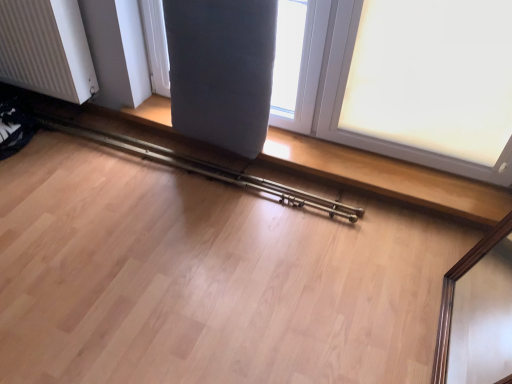
Question: From the image's perspective, would you say metallic brass rail at lower center is shown under matte gray cushion at upper center, which is the 1th window from left to right?

Choices:
 (A) no
 (B) yes

Answer: (B)

Question: Is metallic brass rail at lower center surrounding matte gray cushion at upper center, which is the 1th window from left to right?

Choices:
 (A) no
 (B) yes

Answer: (A)

Question: Considering the relative positions of metallic brass rail at lower center and matte gray cushion at upper center, which is the 1th window from left to right, in the image provided, is metallic brass rail at lower center to the right of matte gray cushion at upper center, which is the 1th window from left to right, from the viewer's perspective?

Choices:
 (A) yes
 (B) no

Answer: (B)

Question: From a real-world perspective, is metallic brass rail at lower center beneath matte gray cushion at upper center, which is the 1th window from left to right?

Choices:
 (A) no
 (B) yes

Answer: (B)

Question: Can you confirm if metallic brass rail at lower center is bigger than matte gray cushion at upper center, which is the 1th window from left to right?

Choices:
 (A) yes
 (B) no

Answer: (B)

Question: Would you say matte gray cushion at upper center, which is the 1th window from left to right, is to the left or to the right of white ribbed radiator at left in the picture?

Choices:
 (A) left
 (B) right

Answer: (B)

Question: Which is correct: matte gray cushion at upper center, the second window positioned from the right, is inside white ribbed radiator at left, or outside of it?

Choices:
 (A) inside
 (B) outside

Answer: (B)

Question: Looking at their shapes, would you say matte gray cushion at upper center, the second window positioned from the right, is wider or thinner than white ribbed radiator at left?

Choices:
 (A) wide
 (B) thin

Answer: (A)

Question: In terms of height, does matte gray cushion at upper center, the second window positioned from the right, look taller or shorter compared to white ribbed radiator at left?

Choices:
 (A) tall
 (B) short

Answer: (A)

Question: Considering their positions, is white frosted glass at upper right, positioned as the 2th window in left-to-right order, located in front of or behind metallic brass rail at lower center?

Choices:
 (A) behind
 (B) front

Answer: (B)

Question: Which is correct: white frosted glass at upper right, marked as the 1th window in a right-to-left arrangement, is inside metallic brass rail at lower center, or outside of it?

Choices:
 (A) outside
 (B) inside

Answer: (A)

Question: Is point (440, 155) closer or farther from the camera than point (135, 142)?

Choices:
 (A) closer
 (B) farther

Answer: (A)

Question: In terms of size, does white frosted glass at upper right, marked as the 1th window in a right-to-left arrangement, appear bigger or smaller than metallic brass rail at lower center?

Choices:
 (A) big
 (B) small

Answer: (A)

Question: From a real-world perspective, is white ribbed radiator at left positioned above or below matte gray cushion at upper center, which is the 1th window from left to right?

Choices:
 (A) below
 (B) above

Answer: (A)

Question: Considering the relative positions of white ribbed radiator at left and matte gray cushion at upper center, the second window positioned from the right, in the image provided, is white ribbed radiator at left to the left or to the right of matte gray cushion at upper center, the second window positioned from the right,?

Choices:
 (A) right
 (B) left

Answer: (B)